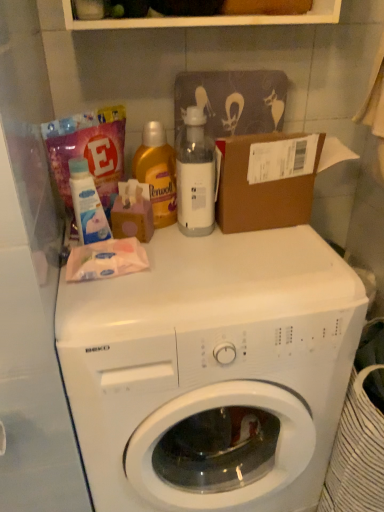
Find the location of a particular element. This screenshot has height=512, width=384. vacant region to the right of white plastic bottle at center is located at coordinates (266, 240).